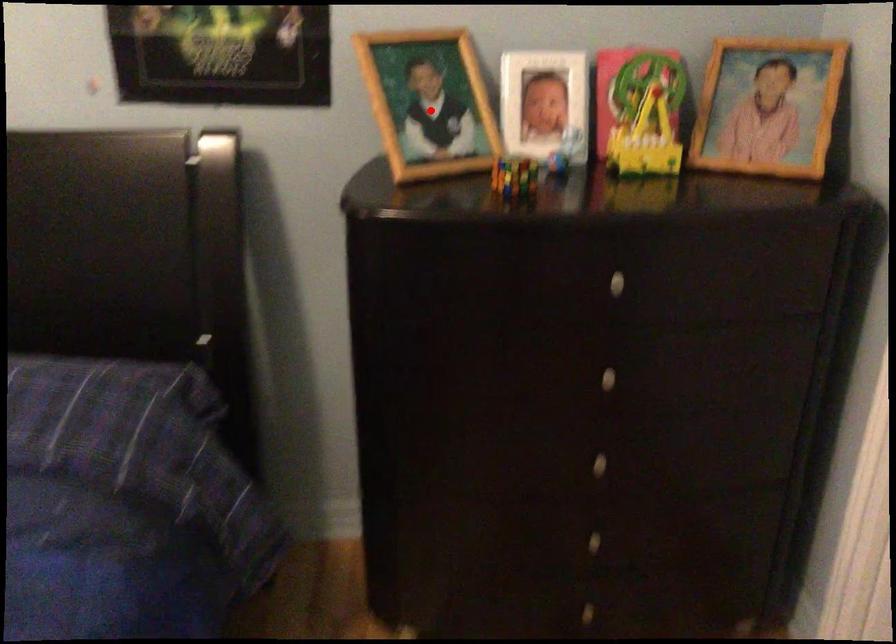
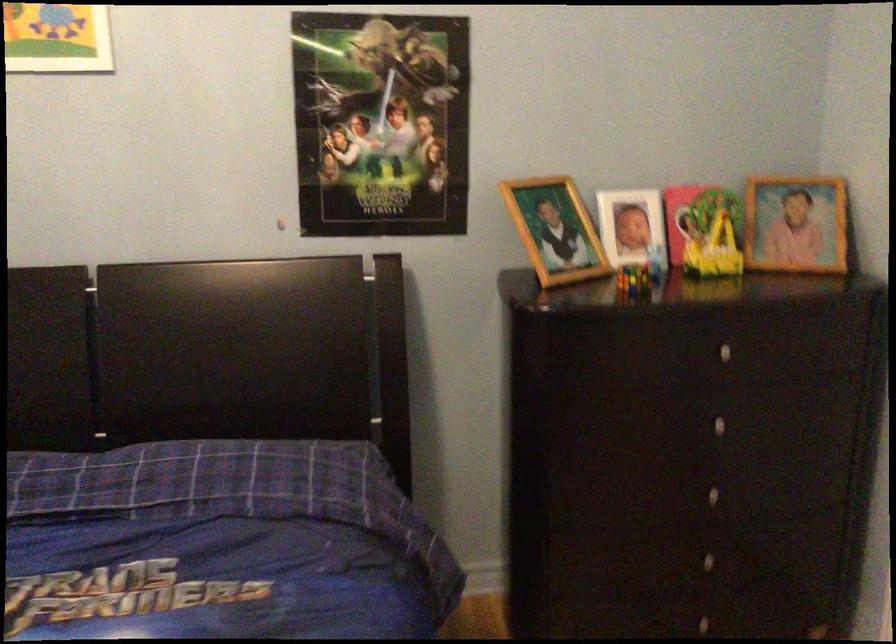
Question: I am providing you with two images of the same scene from different viewpoints. A red point is marked on the first image. At the location where the point appears in image 1, is it still visible in image 2?

Choices:
 (A) Yes
 (B) No

Answer: (A)